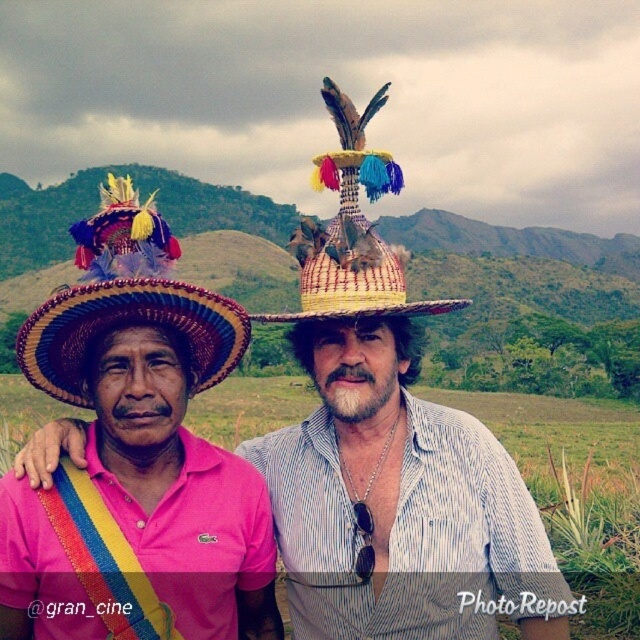
Between point (99, 236) and point (344, 113), which one is positioned in front?

Point (99, 236)

Which is above, woven straw hat at left or bright yellow woven hat at center?

bright yellow woven hat at center

Which is in front, point (29, 374) or point (372, 273)?

Point (372, 273) is more forward.

At what (x,y) coordinates should I click in order to perform the action: click on woven straw hat at left. Please return your answer as a coordinate pair (x, y). Looking at the image, I should click on (125, 300).